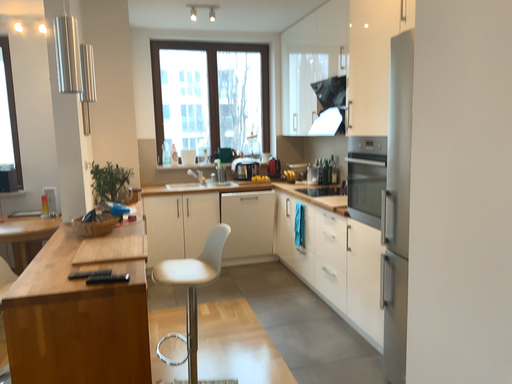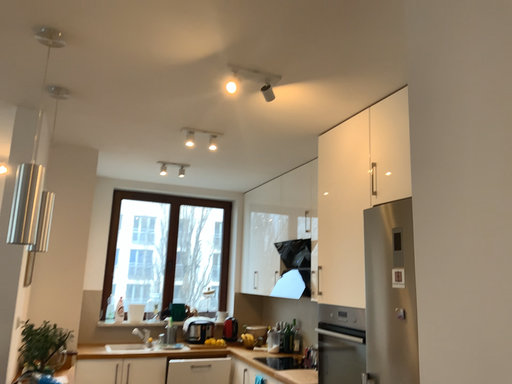
Question: Which way did the camera rotate in the video?

Choices:
 (A) rotated right
 (B) rotated left

Answer: (A)